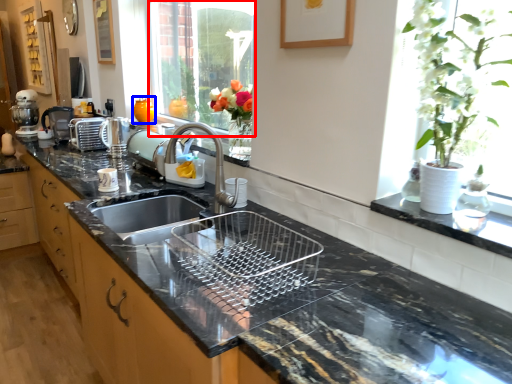
Question: Which point is closer to the camera, window (highlighted by a red box) or vase (highlighted by a blue box)?

Choices:
 (A) window
 (B) vase

Answer: (A)